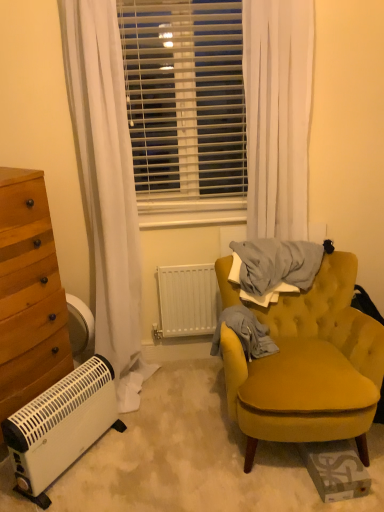
Question: Considering the relative sizes of white plastic heater at lower left and white sheer curtain at upper center in the image provided, is white plastic heater at lower left wider than white sheer curtain at upper center?

Choices:
 (A) yes
 (B) no

Answer: (A)

Question: Would you say white plastic heater at lower left is a long distance from white sheer curtain at upper center?

Choices:
 (A) no
 (B) yes

Answer: (B)

Question: Does white plastic heater at lower left have a larger size compared to white sheer curtain at upper center?

Choices:
 (A) yes
 (B) no

Answer: (B)

Question: Is white plastic heater at lower left facing towards white sheer curtain at upper center?

Choices:
 (A) yes
 (B) no

Answer: (B)

Question: From a real-world perspective, does white plastic heater at lower left sit lower than white sheer curtain at upper center?

Choices:
 (A) yes
 (B) no

Answer: (A)

Question: Considering the relative positions of wooden chest of drawers at left and white matte radiator at center in the image provided, is wooden chest of drawers at left to the left or to the right of white matte radiator at center?

Choices:
 (A) right
 (B) left

Answer: (B)

Question: From the image's perspective, is wooden chest of drawers at left located above or below white matte radiator at center?

Choices:
 (A) below
 (B) above

Answer: (B)

Question: Is wooden chest of drawers at left bigger or smaller than white matte radiator at center?

Choices:
 (A) small
 (B) big

Answer: (B)

Question: Is wooden chest of drawers at left in front of or behind white matte radiator at center in the image?

Choices:
 (A) behind
 (B) front

Answer: (B)

Question: From a real-world perspective, is velvet yellow armchair at right positioned above or below wooden chest of drawers at left?

Choices:
 (A) below
 (B) above

Answer: (A)

Question: Is velvet yellow armchair at right bigger or smaller than wooden chest of drawers at left?

Choices:
 (A) big
 (B) small

Answer: (A)

Question: Considering the relative positions of velvet yellow armchair at right and wooden chest of drawers at left in the image provided, is velvet yellow armchair at right to the left or to the right of wooden chest of drawers at left?

Choices:
 (A) right
 (B) left

Answer: (A)

Question: Does point (258, 415) appear closer or farther from the camera than point (24, 248)?

Choices:
 (A) farther
 (B) closer

Answer: (B)

Question: From the image's perspective, relative to wooden chest of drawers at left, is white plastic heater at lower left above or below?

Choices:
 (A) below
 (B) above

Answer: (A)

Question: Which is correct: white plastic heater at lower left is inside wooden chest of drawers at left, or outside of it?

Choices:
 (A) inside
 (B) outside

Answer: (B)